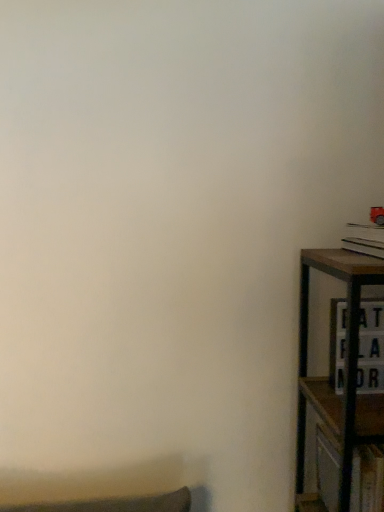
Measure the distance between point (379, 250) and camera.

They are 36.69 inches apart.

What do you see at coordinates (364, 239) in the screenshot?
I see `hardcover book at right` at bounding box center [364, 239].

Identify the location of hardcover book at right. The image size is (384, 512). pos(364,239).

What is the approximate height of hardcover book at right?

hardcover book at right is 2.87 inches in height.

Identify the location of wooden cabinet at right. This screenshot has width=384, height=512. (371, 347).

The width and height of the screenshot is (384, 512). What do you see at coordinates (371, 347) in the screenshot?
I see `wooden cabinet at right` at bounding box center [371, 347].

This screenshot has width=384, height=512. I want to click on hardcover book at right, so click(364, 239).

Considering the relative positions of wooden cabinet at right and hardcover book at right in the image provided, is wooden cabinet at right to the right of hardcover book at right from the viewer's perspective?

Incorrect, wooden cabinet at right is not on the right side of hardcover book at right.

Which object is closer to the camera, wooden cabinet at right or hardcover book at right?

hardcover book at right is more forward.

Which is more distant, (368, 312) or (374, 241)?

Point (368, 312)

From the image's perspective, is wooden cabinet at right under hardcover book at right?

Correct, wooden cabinet at right appears lower than hardcover book at right in the image.

From a real-world perspective, is wooden cabinet at right over hardcover book at right?

No, from a real-world perspective, wooden cabinet at right is not above hardcover book at right.

Between wooden cabinet at right and hardcover book at right, which one has larger width?

hardcover book at right.

Between wooden cabinet at right and hardcover book at right, which one has more height?

Standing taller between the two is wooden cabinet at right.

Considering the sizes of objects wooden cabinet at right and hardcover book at right in the image provided, who is smaller, wooden cabinet at right or hardcover book at right?

Smaller between the two is hardcover book at right.

Is wooden cabinet at right not inside hardcover book at right?

Yes, wooden cabinet at right is located beyond the bounds of hardcover book at right.

Is wooden cabinet at right with hardcover book at right?

No, wooden cabinet at right is not beside hardcover book at right.

Could you tell me if wooden cabinet at right is turned towards hardcover book at right?

No, wooden cabinet at right is not facing towards hardcover book at right.

Looking at this image, measure the distance from wooden cabinet at right to hardcover book at right.

wooden cabinet at right is 9.30 inches from hardcover book at right.

You are a GUI agent. You are given a task and a screenshot of the screen. Output one action in this format:
    pyautogui.click(x=<x>, y=<y>)
    Task: Click on the book in front of the wooden cabinet at right
    The image size is (384, 512).
    Given the screenshot: What is the action you would take?
    pyautogui.click(x=364, y=239)

Visually, is hardcover book at right positioned to the left or to the right of wooden cabinet at right?

Clearly, hardcover book at right is on the right of wooden cabinet at right in the image.

Is hardcover book at right further to the viewer compared to wooden cabinet at right?

No, the depth of hardcover book at right is less than that of wooden cabinet at right.

Does point (348, 247) appear closer or farther from the camera than point (333, 372)?

Clearly, point (348, 247) is closer to the camera than point (333, 372).

From the image's perspective, is hardcover book at right on top of wooden cabinet at right?

Correct, hardcover book at right appears higher than wooden cabinet at right in the image.

From a real-world perspective, is hardcover book at right positioned above or below wooden cabinet at right?

From a real-world perspective, hardcover book at right is physically above wooden cabinet at right.

Considering the relative sizes of hardcover book at right and wooden cabinet at right in the image provided, is hardcover book at right thinner than wooden cabinet at right?

No.

Based on the photo, between hardcover book at right and wooden cabinet at right, which one has more height?

wooden cabinet at right is taller.

Based on the photo, does hardcover book at right have a larger size compared to wooden cabinet at right?

No.

Is wooden cabinet at right a part of hardcover book at right?

No.

Is hardcover book at right far away from wooden cabinet at right?

No, there isn't a large distance between hardcover book at right and wooden cabinet at right.

Is hardcover book at right turned away from wooden cabinet at right?

No, wooden cabinet at right is not at the back of hardcover book at right.

How different are the orientations of hardcover book at right and wooden cabinet at right in degrees?

The angular difference between hardcover book at right and wooden cabinet at right is 4.83 degrees.

Measure the distance from hardcover book at right to wooden cabinet at right.

hardcover book at right is 9.30 inches away from wooden cabinet at right.

You are a GUI agent. You are given a task and a screenshot of the screen. Output one action in this format:
    pyautogui.click(x=<x>, y=<y>)
    Task: Click on the book located on the right of wooden cabinet at right
    
    Given the screenshot: What is the action you would take?
    pyautogui.click(x=364, y=239)

Locate an element on the screen. This screenshot has width=384, height=512. book above the wooden cabinet at right (from a real-world perspective) is located at coordinates (364, 239).

This screenshot has height=512, width=384. Identify the location of book on the right side of wooden cabinet at right. (364, 239).